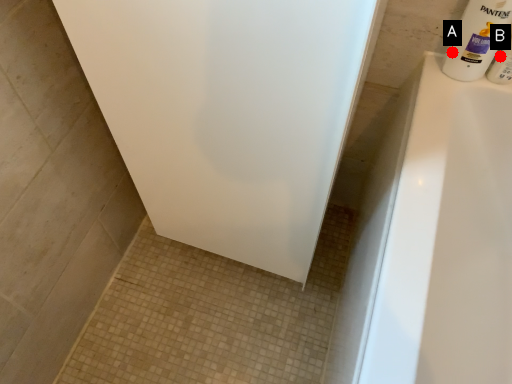
Question: Two points are circled on the image, labeled by A and B beside each circle. Which point appears closest to the camera in this image?

Choices:
 (A) A is closer
 (B) B is closer

Answer: (B)